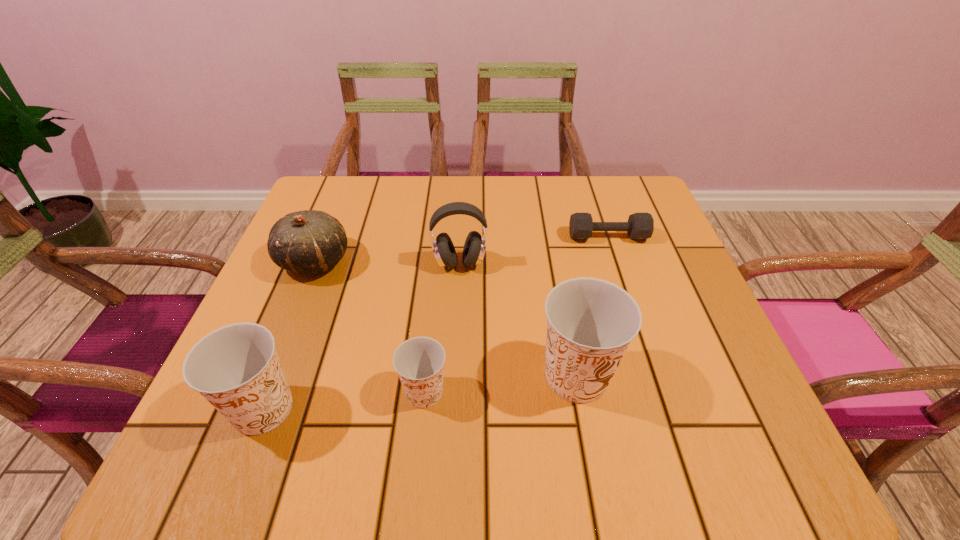
Locate an element on the screen. free space between the shortest object and the leftmost Dixie cup is located at coordinates (436, 322).

At what (x,y) coordinates should I click in order to perform the action: click on vacant area that lies between the dumbbell and the second shortest Dixie cup. Please return your answer as a coordinate pair (x, y). Image resolution: width=960 pixels, height=540 pixels. Looking at the image, I should click on (436, 322).

Find the location of a particular element. This screenshot has height=540, width=960. free spot between the rightmost Dixie cup and the headset is located at coordinates (518, 320).

This screenshot has height=540, width=960. What are the coordinates of `free space between the headset and the dumbbell` in the screenshot? It's located at (534, 250).

Where is `empty space that is in between the leftmost Dixie cup and the shortest object`? empty space that is in between the leftmost Dixie cup and the shortest object is located at coordinates (436, 322).

I want to click on object that is the fourth closest one to the second shortest object, so click(309, 242).

This screenshot has width=960, height=540. Find the location of `object that is the second closest to the second shortest object`. object that is the second closest to the second shortest object is located at coordinates [x=236, y=368].

Where is `Dixie cup that stands as the closest to the second Dixie cup from left to right`? The width and height of the screenshot is (960, 540). Dixie cup that stands as the closest to the second Dixie cup from left to right is located at coordinates (590, 323).

Select which Dixie cup is the third closest to the shortest object. Please provide its 2D coordinates. Your answer should be formatted as a tuple, i.e. [(x, y)], where the tuple contains the x and y coordinates of a point satisfying the conditions above.

[(236, 368)]

I want to click on vacant position in the image that satisfies the following two spatial constraints: 1. on the ear cups of the headset; 2. on the left side of the rightmost Dixie cup, so click(x=454, y=376).